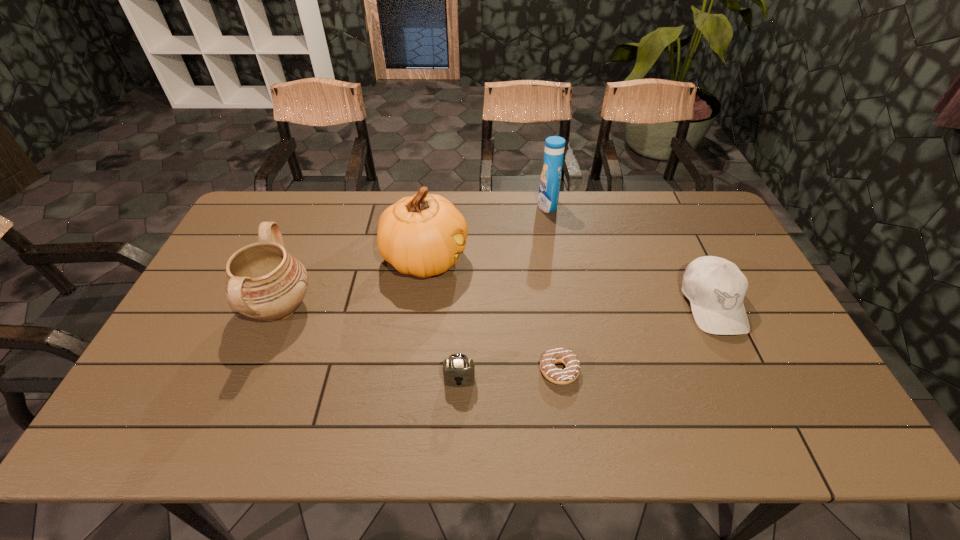
You are a GUI agent. You are given a task and a screenshot of the screen. Output one action in this format:
    pyautogui.click(x=<x>, y=<y>)
    Task: Click on the free region at the left edge of the desktop
    This screenshot has width=960, height=540.
    Given the screenshot: What is the action you would take?
    click(147, 396)

Where is `blank space at the right edge of the desktop`? The image size is (960, 540). blank space at the right edge of the desktop is located at coordinates (708, 249).

I want to click on vacant area at the far right corner of the desktop, so click(x=684, y=212).

The height and width of the screenshot is (540, 960). In order to click on free space between the doughnut and the padlock in this screenshot , I will do `click(510, 375)`.

Identify the location of vacant area that lies between the detergent and the doughnut. This screenshot has width=960, height=540. (553, 288).

At what (x,y) coordinates should I click in order to perform the action: click on empty space that is in between the doughnut and the padlock. Please return your answer as a coordinate pair (x, y). Looking at the image, I should click on (510, 375).

I want to click on free space between the second shortest object and the baseball cap, so click(x=586, y=342).

Find the location of a particular element. The image size is (960, 540). vacant point located between the pumpkin and the baseball cap is located at coordinates (568, 281).

This screenshot has width=960, height=540. What are the coordinates of `vacant area between the padlock and the pumpkin` in the screenshot? It's located at (443, 319).

Locate an element on the screen. The image size is (960, 540). empty space between the doughnut and the pumpkin is located at coordinates (492, 314).